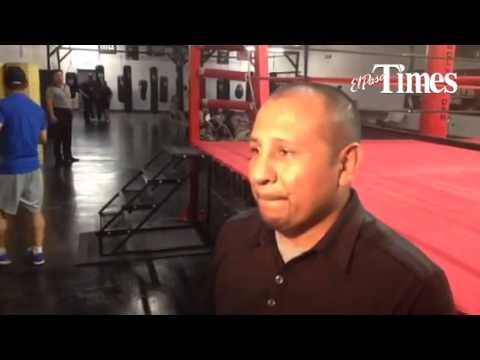
Where is `third black stair`? This screenshot has height=360, width=480. third black stair is located at coordinates (164, 180).